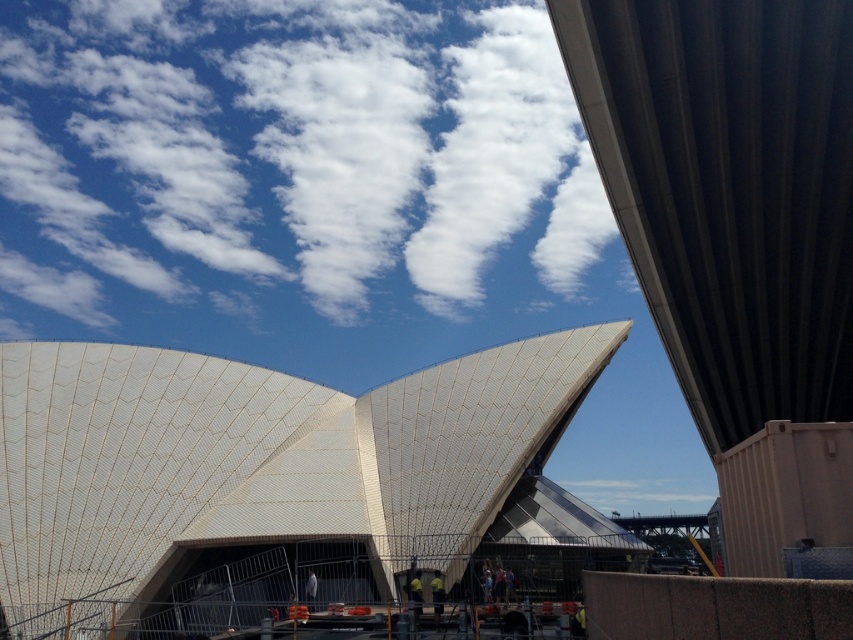
You are a tourist visiting Sydney Opera House and want to take a photo of the white textured roof at center and the yellow fabric construction worker at center. Which object should you focus on first if you want to capture both in the same frame?

The white textured roof at center is located above the yellow fabric construction worker at center, so you should focus on the yellow fabric construction worker at center first to ensure both are in the same frame.

You are a tourist visiting the Sydney Opera House and notice the white textured roof at center and the yellow fabric construction worker at center in the scene. Which object appears taller in the image?

The white textured roof at center appears taller than the yellow fabric construction worker at center in the image.

You are a tourist visiting Sydney and want to take a photo of the Sydney Opera House. You have a camera with a zoom lens. The white fluffy cloud at upper center and the light blue fabric construction worker at lower center are both in your viewfinder. Which object will appear larger in your photo?

The white fluffy cloud at upper center will appear larger in the photo because it is much taller than the light blue fabric construction worker at lower center.